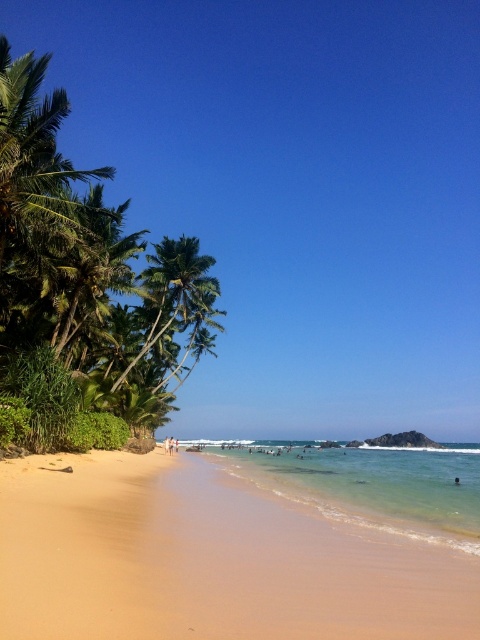
Question: Is green leafy palm tree at left thinner than clear water at beach center?

Choices:
 (A) yes
 (B) no

Answer: (A)

Question: Does sandy beach at lower left have a greater width compared to green leafy palm tree at left?

Choices:
 (A) no
 (B) yes

Answer: (B)

Question: Which object is closer to the camera taking this photo?

Choices:
 (A) green leafy palm tree at left
 (B) sandy beach at lower left

Answer: (B)

Question: Can you confirm if sandy beach at lower left is bigger than clear water at beach center?

Choices:
 (A) yes
 (B) no

Answer: (B)

Question: Among these objects, which one is nearest to the camera?

Choices:
 (A) sandy beach at lower left
 (B) green leafy palm tree at left
 (C) clear water at beach center

Answer: (A)

Question: Which object appears farthest from the camera in this image?

Choices:
 (A) clear water at beach center
 (B) green leafy palm tree at left

Answer: (B)